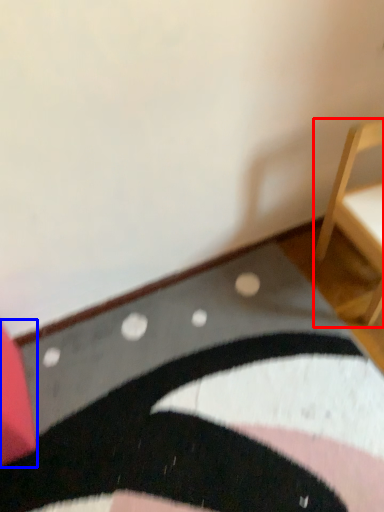
Question: Which object appears closest to the camera in this image, furniture (highlighted by a red box) or furniture (highlighted by a blue box)?

Choices:
 (A) furniture
 (B) furniture

Answer: (B)